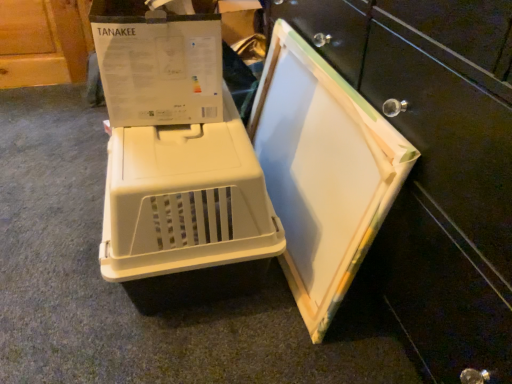
Image resolution: width=512 pixels, height=384 pixels. In order to click on white cardboard at center in this screenshot , I will do `click(323, 171)`.

Describe the element at coordinates (323, 171) in the screenshot. The image size is (512, 384). I see `white cardboard at center` at that location.

Describe the element at coordinates (175, 150) in the screenshot. I see `beige plastic crate at center` at that location.

The image size is (512, 384). Identify the location of beige plastic crate at center. (175, 150).

Where is `white cardboard at center`? The width and height of the screenshot is (512, 384). white cardboard at center is located at coordinates (323, 171).

Which object is positioned more to the left, beige plastic crate at center or white cardboard at center?

Positioned to the left is beige plastic crate at center.

Which object is closer to the camera taking this photo, beige plastic crate at center or white cardboard at center?

Positioned in front is white cardboard at center.

Does point (202, 154) come behind point (283, 208)?

No.

From the image's perspective, would you say beige plastic crate at center is positioned over white cardboard at center?

No.

From a real-world perspective, is beige plastic crate at center positioned above or below white cardboard at center?

beige plastic crate at center is below white cardboard at center.

Can you confirm if beige plastic crate at center is thinner than white cardboard at center?

No, beige plastic crate at center is not thinner than white cardboard at center.

From the picture: Can you confirm if beige plastic crate at center is shorter than white cardboard at center?

Yes.

Who is bigger, beige plastic crate at center or white cardboard at center?

beige plastic crate at center is bigger.

Is beige plastic crate at center inside or outside of white cardboard at center?

beige plastic crate at center is not inside white cardboard at center, it's outside.

Is beige plastic crate at center not close to white cardboard at center?

No, beige plastic crate at center is not far from white cardboard at center.

Is beige plastic crate at center facing towards white cardboard at center?

No, beige plastic crate at center is not facing towards white cardboard at center.

What are the coordinates of `home appliance in front of the beige plastic crate at center` in the screenshot? It's located at (323, 171).

Based on the photo, would you say white cardboard at center is to the left or to the right of beige plastic crate at center in the picture?

In the image, white cardboard at center appears on the right side of beige plastic crate at center.

Is white cardboard at center in front of or behind beige plastic crate at center in the image?

In the image, white cardboard at center appears in front of beige plastic crate at center.

Between point (352, 175) and point (197, 163), which one is positioned behind?

Positioned behind is point (352, 175).

From the image's perspective, between white cardboard at center and beige plastic crate at center, which one is located above?

white cardboard at center appears higher in the image.

From a real-world perspective, which is physically above, white cardboard at center or beige plastic crate at center?

In real-world perspective, white cardboard at center is above.

Can you confirm if white cardboard at center is wider than beige plastic crate at center?

In fact, white cardboard at center might be narrower than beige plastic crate at center.

Can you confirm if white cardboard at center is shorter than beige plastic crate at center?

No.

Based on their sizes in the image, would you say white cardboard at center is bigger or smaller than beige plastic crate at center?

Considering their sizes, white cardboard at center takes up less space than beige plastic crate at center.

Is white cardboard at center inside or outside of beige plastic crate at center?

white cardboard at center is not inside beige plastic crate at center, it's outside.

Is white cardboard at center not close to beige plastic crate at center?

No, there isn't a large distance between white cardboard at center and beige plastic crate at center.

Could you tell me if white cardboard at center is facing beige plastic crate at center?

Yes, white cardboard at center is aimed at beige plastic crate at center.

What are the coordinates of `home appliance lying in front of the beige plastic crate at center` in the screenshot? It's located at (323, 171).

Locate an element on the screen. Image resolution: width=512 pixels, height=384 pixels. home appliance above the beige plastic crate at center (from a real-world perspective) is located at coordinates pos(323,171).

I want to click on appliance behind the white cardboard at center, so click(175, 150).